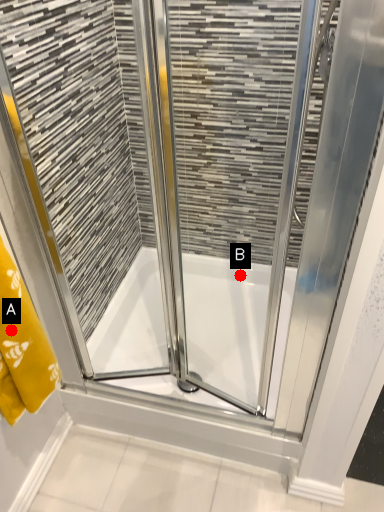
Question: Two points are circled on the image, labeled by A and B beside each circle. Which point is farther to the camera?

Choices:
 (A) A is further
 (B) B is further

Answer: (B)